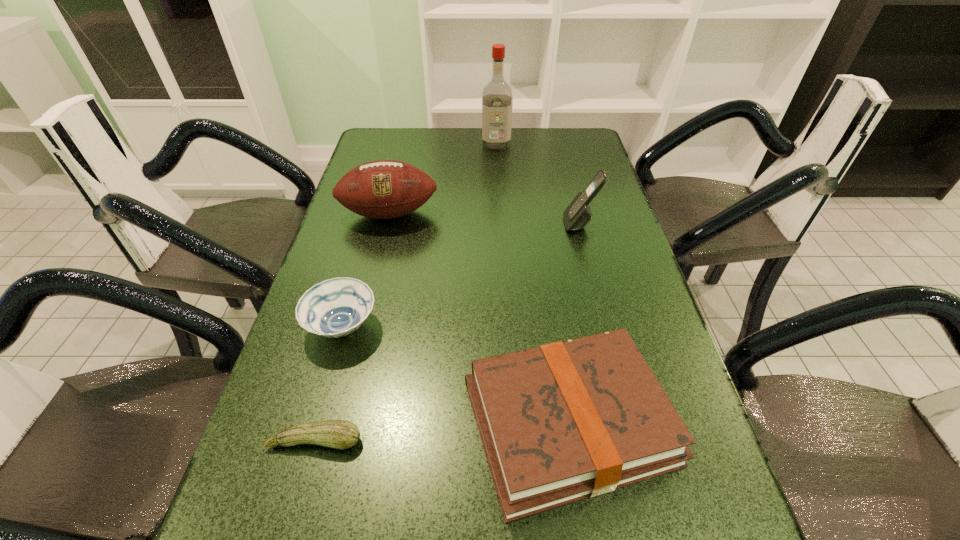
At what (x,y) coordinates should I click in order to perform the action: click on blank region between the cellular telephone and the zucchini. Please return your answer as a coordinate pair (x, y). This screenshot has width=960, height=540. Looking at the image, I should click on coord(447,332).

Locate an element on the screen. The image size is (960, 540). object that can be found as the third closest to the soup bowl is located at coordinates (383, 189).

Identify the location of object that is the fifth closest to the liquor. (341, 434).

You are a GUI agent. You are given a task and a screenshot of the screen. Output one action in this format:
    pyautogui.click(x=<x>, y=<y>)
    Task: Click on the vacant space that satisfies the following two spatial constraints: 1. on the front-facing side of the cellular telephone; 2. at the stem end of the shortest object
    
    Given the screenshot: What is the action you would take?
    pyautogui.click(x=636, y=441)

Where is `free space that satisfies the following two spatial constraints: 1. on the front side of the hardback book; 2. on the right side of the soup bowl`? This screenshot has width=960, height=540. free space that satisfies the following two spatial constraints: 1. on the front side of the hardback book; 2. on the right side of the soup bowl is located at coordinates (316, 423).